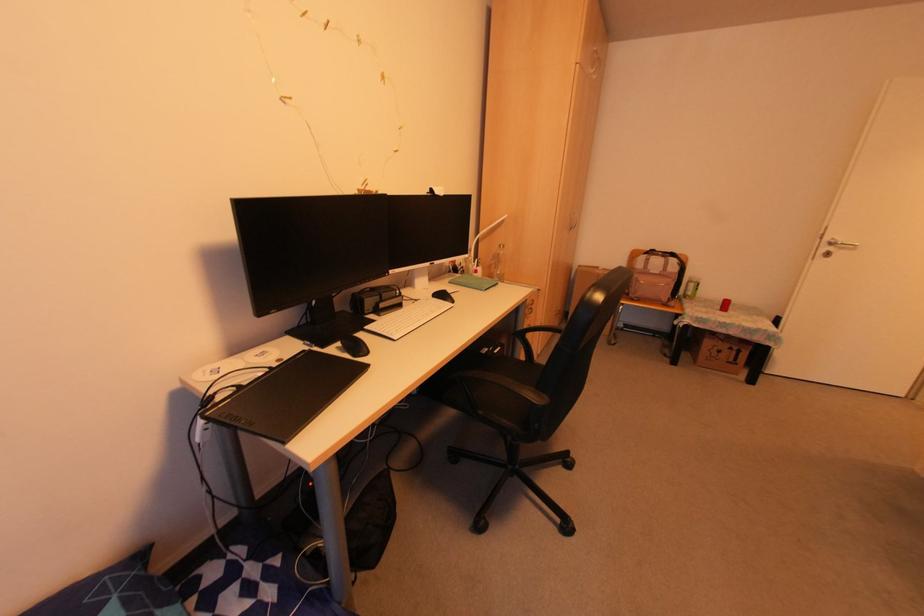
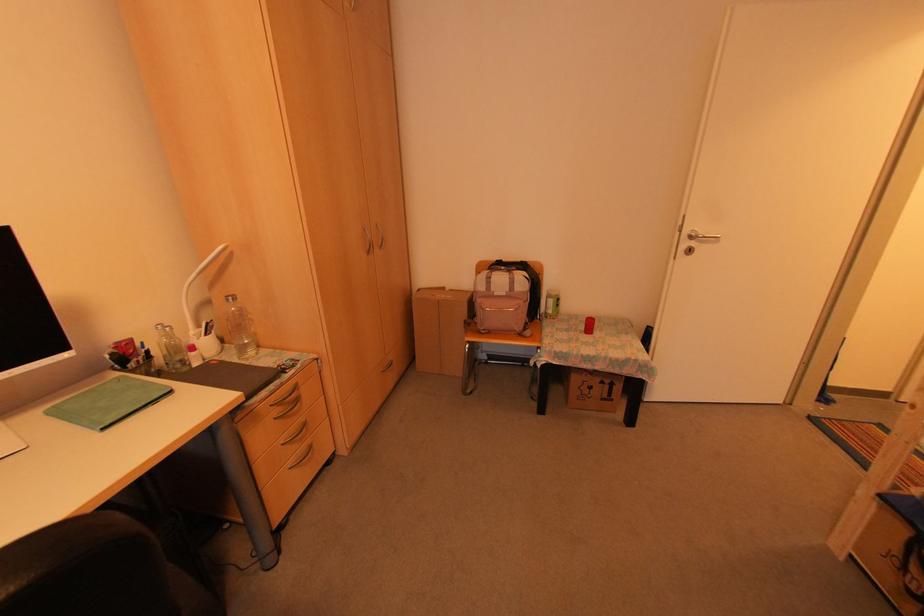
Where in the second image is the point corresponding to point 499,246 from the first image?

(225, 300)